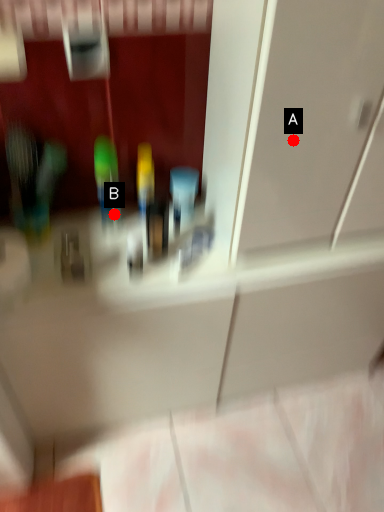
Question: Two points are circled on the image, labeled by A and B beside each circle. Which point appears closest to the camera in this image?

Choices:
 (A) A is closer
 (B) B is closer

Answer: (A)